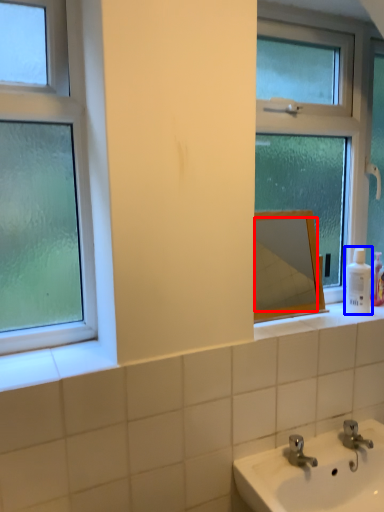
Question: Which object appears farthest to the camera in this image, mirror (highlighted by a red box) or toiletry (highlighted by a blue box)?

Choices:
 (A) mirror
 (B) toiletry

Answer: (B)